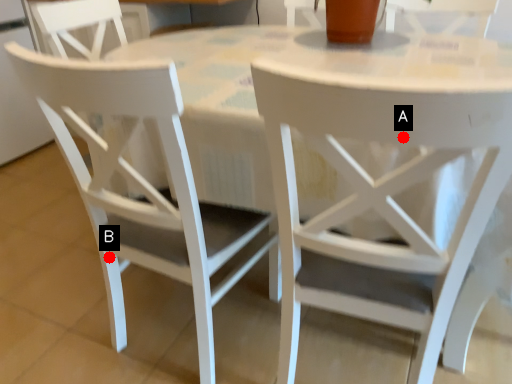
Question: Two points are circled on the image, labeled by A and B beside each circle. Which point is farther to the camera?

Choices:
 (A) A is further
 (B) B is further

Answer: (B)